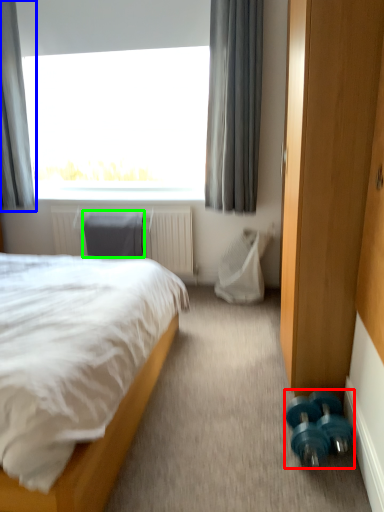
Question: Considering the real-world distances, which object is closest to dumbbell (highlighted by a red box)? curtain (highlighted by a blue box) or swivel chair (highlighted by a green box).

Choices:
 (A) curtain
 (B) swivel chair

Answer: (B)